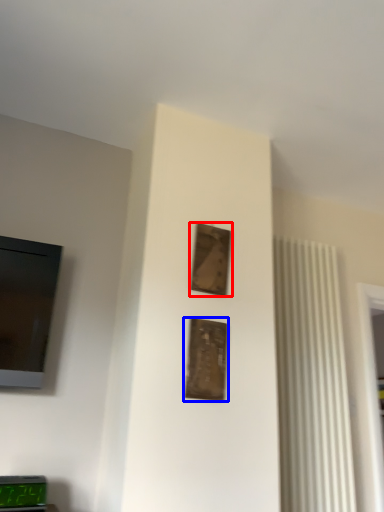
Question: Which of the following is the closest to the observer, picture frame (highlighted by a red box) or picture frame (highlighted by a blue box)?

Choices:
 (A) picture frame
 (B) picture frame

Answer: (B)